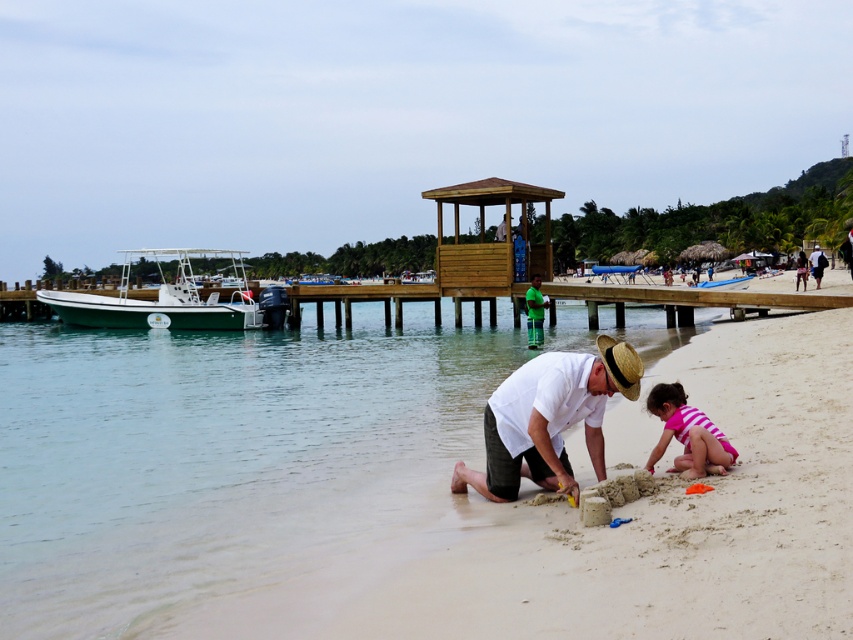
Question: Is white matte shirt at center positioned behind pink striped swimsuit at lower right?

Choices:
 (A) yes
 (B) no

Answer: (B)

Question: Can you confirm if beige sandy beach at lower center is smaller than pink striped swimsuit at lower right?

Choices:
 (A) yes
 (B) no

Answer: (B)

Question: Which object is the farthest from the white matte shirt at center?

Choices:
 (A) beige sandy beach at lower center
 (B) white cotton shirt at lower right
 (C) pink striped swimsuit at lower right

Answer: (B)

Question: Can you confirm if pink striped swimsuit at lower right is positioned to the left of white cotton shirt at lower right?

Choices:
 (A) no
 (B) yes

Answer: (B)

Question: Estimate the real-world distances between objects in this image. Which object is closer to the white matte shirt at center?

Choices:
 (A) beige sandy beach at lower center
 (B) pink striped swimsuit at lower right
 (C) white cotton shirt at lower right

Answer: (B)

Question: Among these objects, which one is nearest to the camera?

Choices:
 (A) white matte shirt at center
 (B) white cotton shirt at lower right
 (C) beige sandy beach at lower center

Answer: (C)